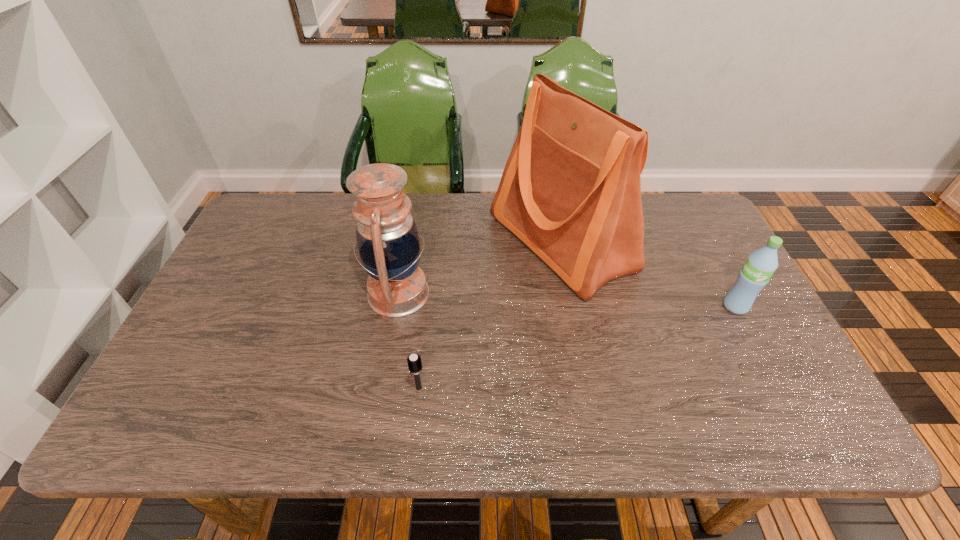
Where is `free space that satisfies the following two spatial constraints: 1. on the front side of the rightmost object; 2. on the right side of the shopping bag`? free space that satisfies the following two spatial constraints: 1. on the front side of the rightmost object; 2. on the right side of the shopping bag is located at coordinates (573, 306).

The width and height of the screenshot is (960, 540). Find the location of `free location that satisfies the following two spatial constraints: 1. on the front side of the oil lamp; 2. on the left side of the third tallest object`. free location that satisfies the following two spatial constraints: 1. on the front side of the oil lamp; 2. on the left side of the third tallest object is located at coordinates (396, 306).